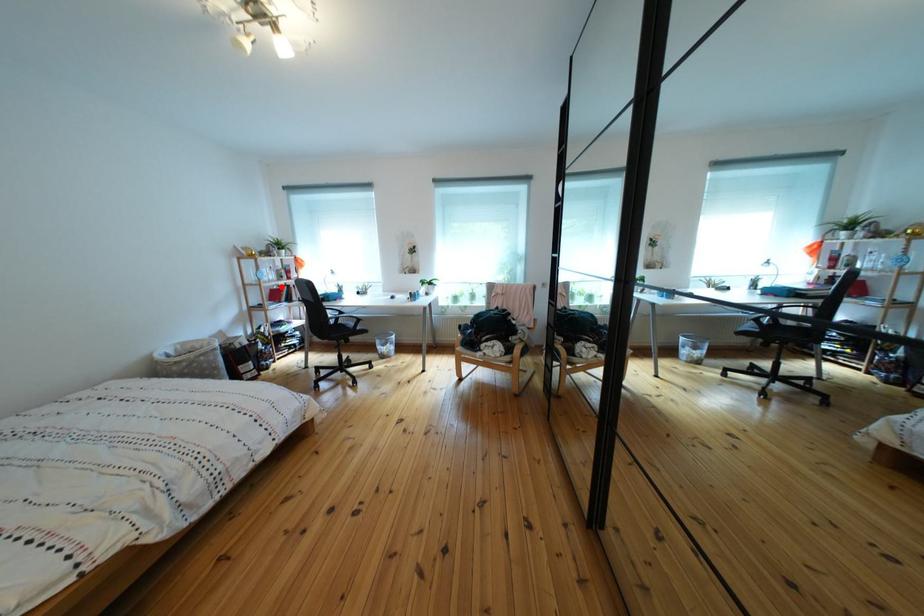
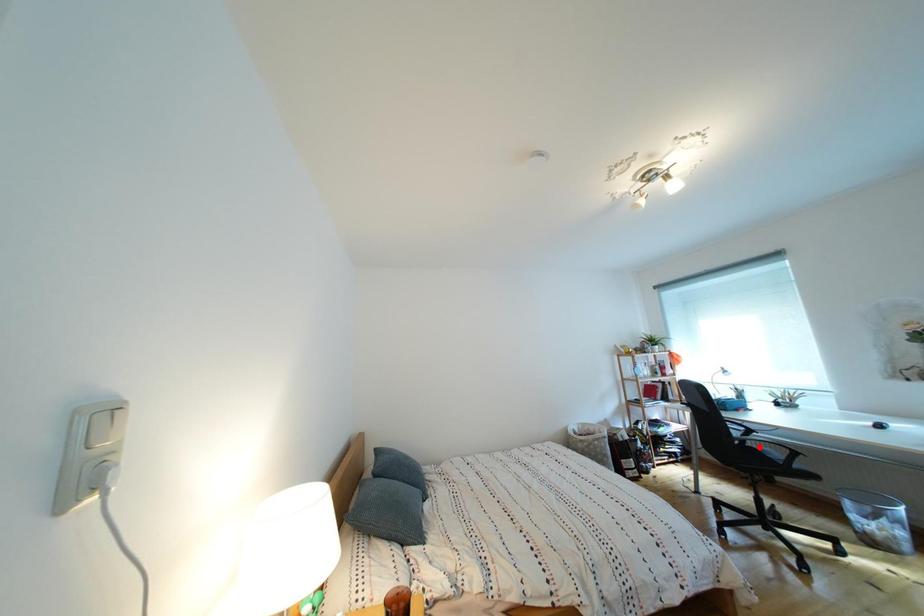
I am providing you with two images of the same scene from different viewpoints. A red point is marked on the first image and another point is marked on the second image. Is the red point in image1 aligned with the point shown in image2?

No